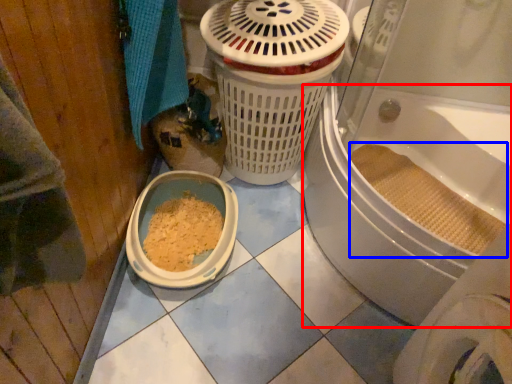
Question: Which object appears closest to the camera in this image, bath (highlighted by a red box) or debris (highlighted by a blue box)?

Choices:
 (A) bath
 (B) debris

Answer: (A)